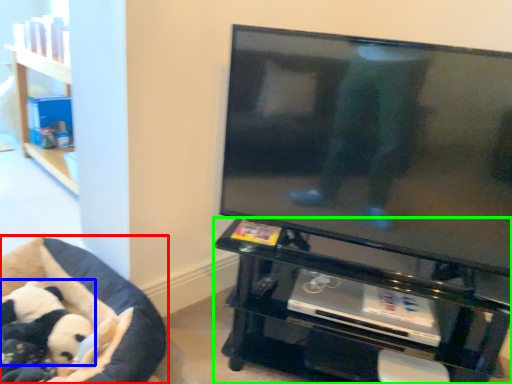
Question: Estimate the real-world distances between objects in this image. Which object is farther from furniture (highlighted by a red box), panda (highlighted by a blue box) or furniture (highlighted by a green box)?

Choices:
 (A) panda
 (B) furniture

Answer: (B)